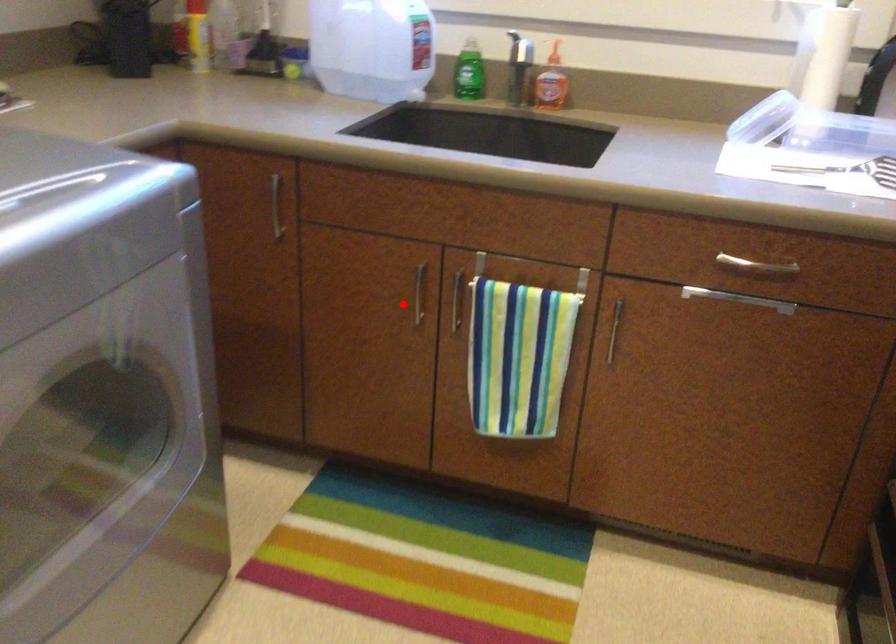
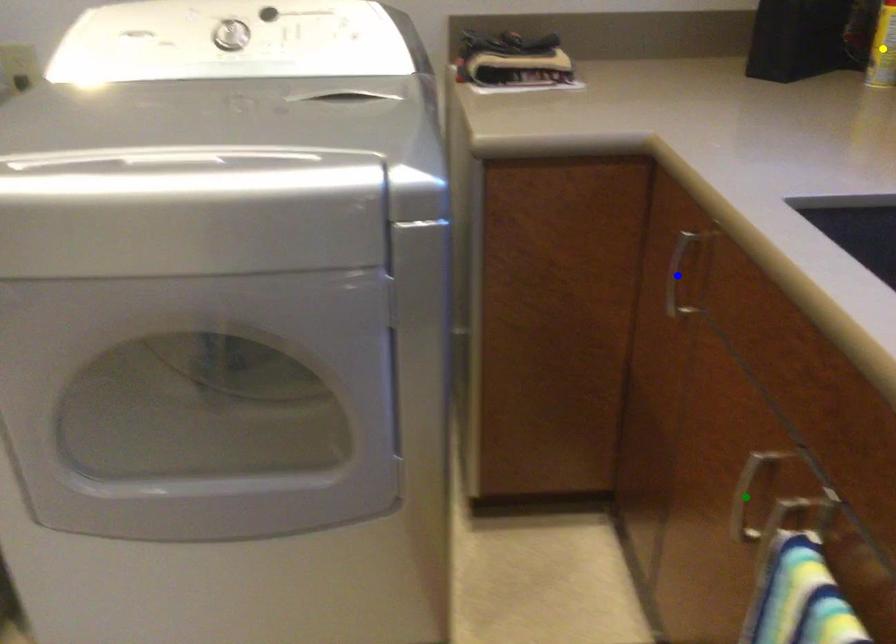
Question: I am providing you with two images of the same scene from different viewpoints. A red point is marked on the first image. You are given multiple points on the second image. Which point in image 2 is actually the same real-world point as the red point in image 1?

Choices:
 (A) blue point
 (B) green point
 (C) yellow point

Answer: (B)